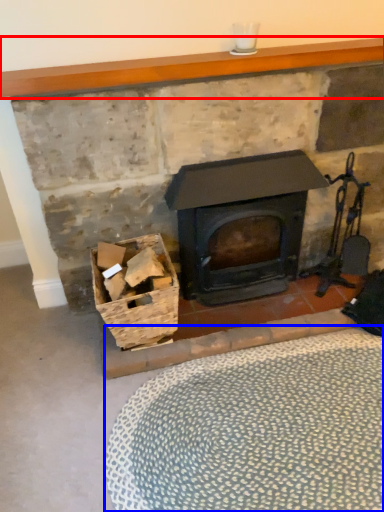
Question: Which point is closer to the camera, mantle (highlighted by a red box) or plain (highlighted by a blue box)?

Choices:
 (A) mantle
 (B) plain

Answer: (B)